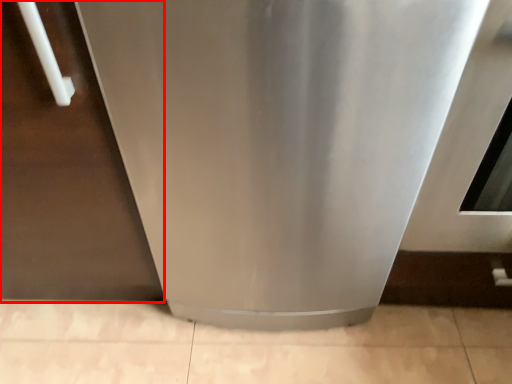
Question: From the image's perspective, what is the correct spatial positioning of door (annotated by the red box) in reference to home appliance?

Choices:
 (A) above
 (B) below

Answer: (B)